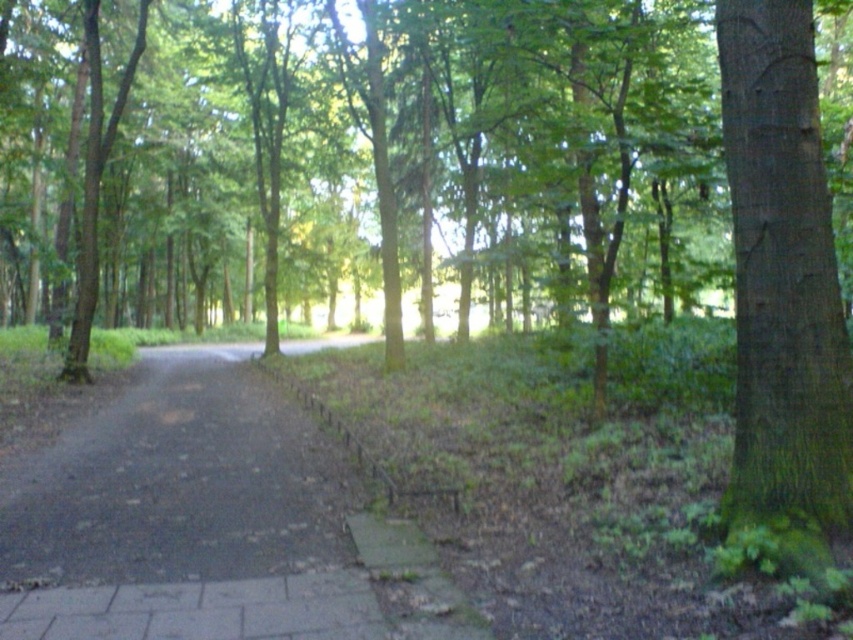
Can you confirm if paved asphalt path at center is wider than green mossy bark tree at right?

Yes, paved asphalt path at center is wider than green mossy bark tree at right.

Who is positioned more to the left, paved asphalt path at center or green mossy bark tree at right?

paved asphalt path at center is more to the left.

Between point (271, 636) and point (802, 90), which one is positioned in front?

Point (271, 636) is in front.

Find the location of a particular element. The width and height of the screenshot is (853, 640). paved asphalt path at center is located at coordinates (206, 525).